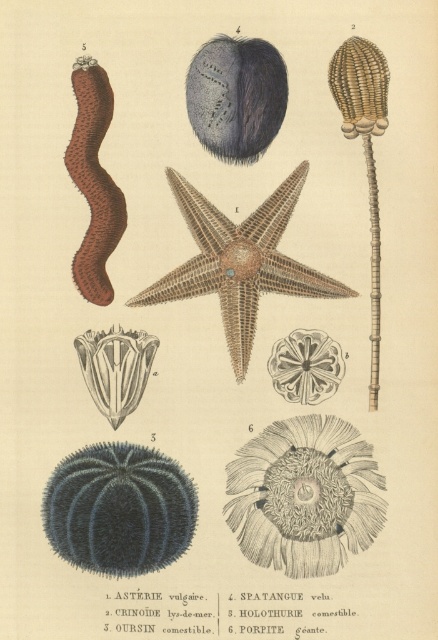
Which is behind, point (162, 528) or point (253, 51)?

Point (253, 51)

Does point (117, 508) come closer to viewer compared to point (194, 108)?

Yes.

Image resolution: width=438 pixels, height=640 pixels. Find the location of `blue spiny sea urchin at lower left`. blue spiny sea urchin at lower left is located at coordinates (119, 509).

Can you confirm if fuzzy dark blue sea urchin at center is positioned below translucent white coral at center?

No, fuzzy dark blue sea urchin at center is not below translucent white coral at center.

Between fuzzy dark blue sea urchin at center and translucent white coral at center, which one appears on the right side from the viewer's perspective?

From the viewer's perspective, fuzzy dark blue sea urchin at center appears more on the right side.

Find the location of a particular element. fuzzy dark blue sea urchin at center is located at coordinates (236, 97).

Between blue spiny sea urchin at upper left and brown textured starfish at center, which one has more height?

With more height is blue spiny sea urchin at upper left.

Is point (353, 525) less distant than point (239, 225)?

Yes, it is.

Who is more forward, (84,522) or (268,264)?

Point (84,522) is more forward.

Where is `blue spiny sea urchin at upper left`? blue spiny sea urchin at upper left is located at coordinates (304, 496).